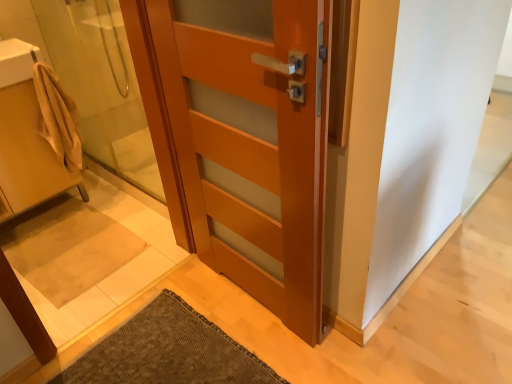
Identify the location of blank space to the left of matte wood door at center. (181, 317).